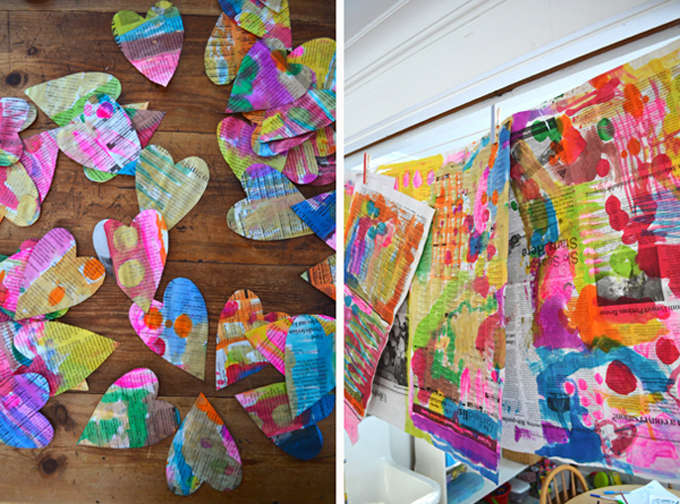
Locate an element on the screen. The image size is (680, 504). table is located at coordinates (583, 496).